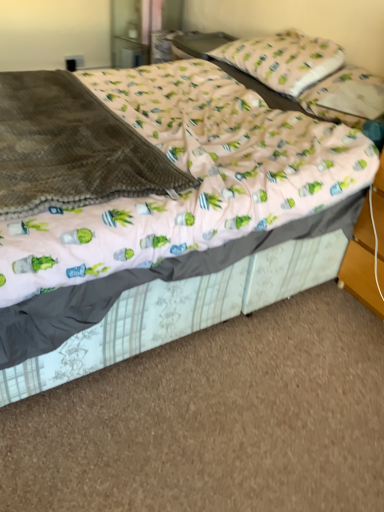
Question: Can you confirm if pink fabric bed at center is bigger than pink fabric pillow at upper center, which is counted as the first pillow, starting from the top?

Choices:
 (A) no
 (B) yes

Answer: (B)

Question: Is pink fabric bed at center further to camera compared to pink fabric pillow at upper center, which is counted as the first pillow, starting from the top?

Choices:
 (A) no
 (B) yes

Answer: (A)

Question: Is pink fabric bed at center positioned in front of pink fabric pillow at upper center, the 2th pillow from the bottom?

Choices:
 (A) no
 (B) yes

Answer: (B)

Question: Is pink fabric bed at center at the right side of pink fabric pillow at upper center, the 2th pillow from the bottom?

Choices:
 (A) yes
 (B) no

Answer: (B)

Question: Is pink fabric pillow at upper center, which is counted as the first pillow, starting from the top, a part of pink fabric bed at center?

Choices:
 (A) yes
 (B) no

Answer: (A)

Question: Choose the correct answer: Is pink fabric bed at center inside pink fabric pillow at upper center, which is counted as the first pillow, starting from the top, or outside it?

Choices:
 (A) inside
 (B) outside

Answer: (B)

Question: Is pink fabric bed at center in front of or behind pink fabric pillow at upper center, the 2th pillow from the bottom, in the image?

Choices:
 (A) front
 (B) behind

Answer: (A)

Question: Is pink fabric bed at center wider or thinner than pink fabric pillow at upper center, which is counted as the first pillow, starting from the top?

Choices:
 (A) thin
 (B) wide

Answer: (B)

Question: From a real-world perspective, relative to pink fabric pillow at upper center, which is counted as the first pillow, starting from the top, is pink fabric bed at center vertically above or below?

Choices:
 (A) above
 (B) below

Answer: (B)

Question: Considering the positions of point (372, 95) and point (314, 219), is point (372, 95) closer or farther from the camera than point (314, 219)?

Choices:
 (A) farther
 (B) closer

Answer: (A)

Question: Is pink fabric pillow at upper right, the 2th pillow when ordered from top to bottom, in front of or behind pink fabric bed at center in the image?

Choices:
 (A) front
 (B) behind

Answer: (B)

Question: From a real-world perspective, is pink fabric pillow at upper right, the 1th pillow positioned from the bottom, physically located above or below pink fabric bed at center?

Choices:
 (A) above
 (B) below

Answer: (A)

Question: Is pink fabric pillow at upper right, the 1th pillow positioned from the bottom, spatially inside pink fabric bed at center, or outside of it?

Choices:
 (A) outside
 (B) inside

Answer: (B)

Question: Based on their positions, is brown fleece blanket at left located to the left or right of pink fabric pillow at upper right, the 2th pillow when ordered from top to bottom?

Choices:
 (A) left
 (B) right

Answer: (A)

Question: Is brown fleece blanket at left spatially inside pink fabric pillow at upper right, the 2th pillow when ordered from top to bottom, or outside of it?

Choices:
 (A) inside
 (B) outside

Answer: (B)